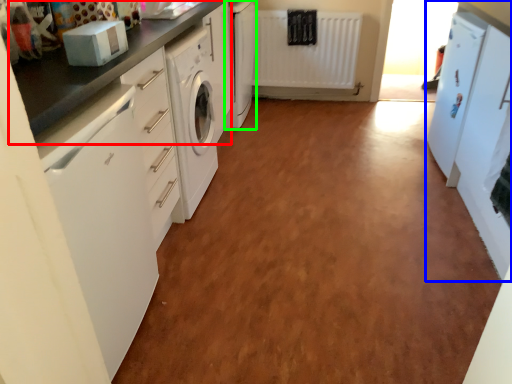
Question: Which object is the farthest from countertop (highlighted by a red box)? Choose among these: cabinetry (highlighted by a blue box) or cabinetry (highlighted by a green box).

Choices:
 (A) cabinetry
 (B) cabinetry

Answer: (A)